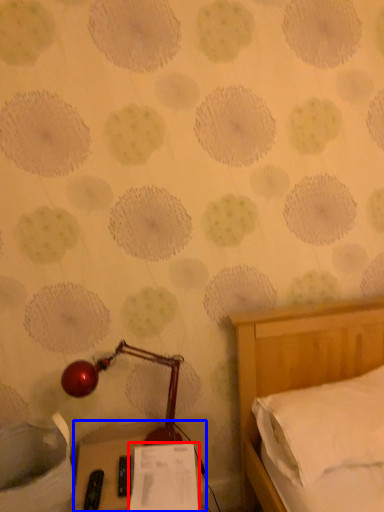
Question: Which point is further to the camera, paper (highlighted by a red box) or furniture (highlighted by a blue box)?

Choices:
 (A) paper
 (B) furniture

Answer: (A)